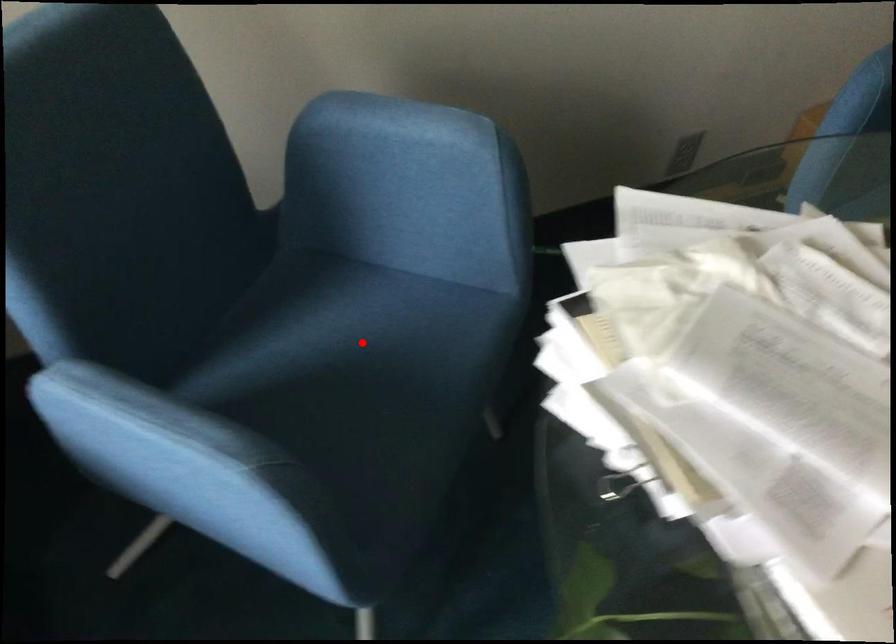
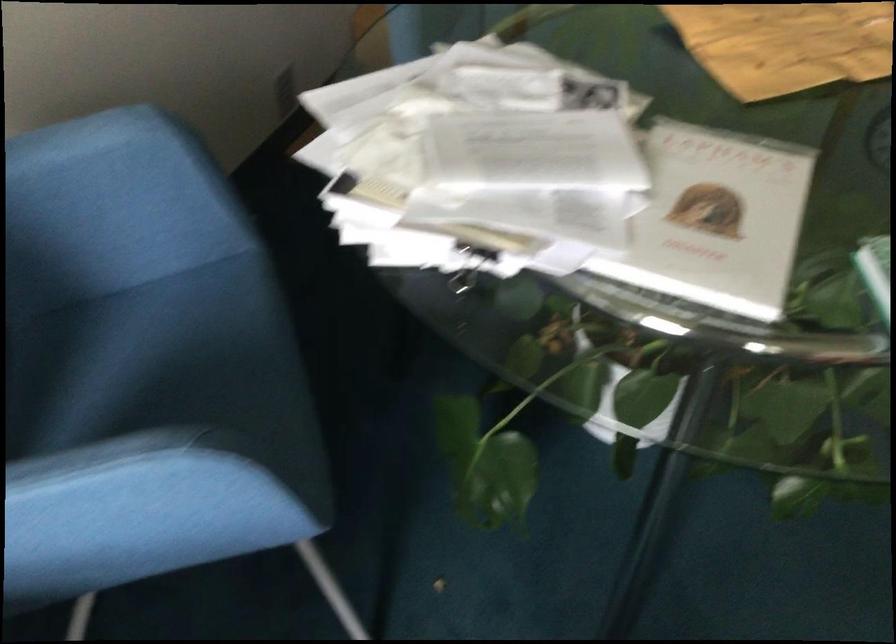
Question: I am providing you with two images of the same scene from different viewpoints. A red point is marked on the first image. Can you still see the location of the red point in image 2?

Choices:
 (A) Yes
 (B) No

Answer: (A)